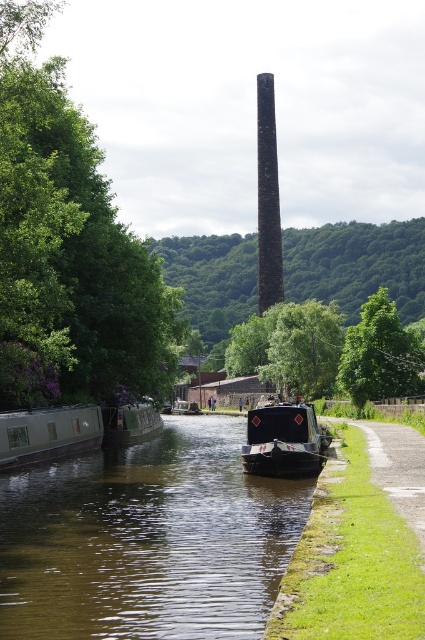
You are navigating a small drone that needs to fly from the grassy embankment on the right to the matte black boat at left without crossing the canal water. Can the drone reach the boat directly from the embankment, or does it need to go around the canal?

The matte black boat at left is located at point (x=48, y=433), which means it is positioned on the left side of the canal. Since the drone cannot cross the canal water, it would need to go around the canal to reach the boat from the embankment on the right.

You are a photographer planning to take a photo of the black stone chimney at center and the green matte boat at left. Based on their positions, which object would appear larger in the photo?

The black stone chimney at center appears larger in the photo because it is located above the green matte boat at left, indicating it is closer to the camera, making it appear bigger.

You are standing on the grassy embankment on the right side of the canal. You want to take a photo of both the black glossy boat at center and the green matte boat at left. Which boat should you position closer to the edge of the embankment to include both in your shot?

To include both the black glossy boat at center and the green matte boat at left in your photo, you should position closer to the edge of the embankment the black glossy boat at center since it is to the right of the green matte boat at left, so moving closer to the edge will help frame both in the shot.